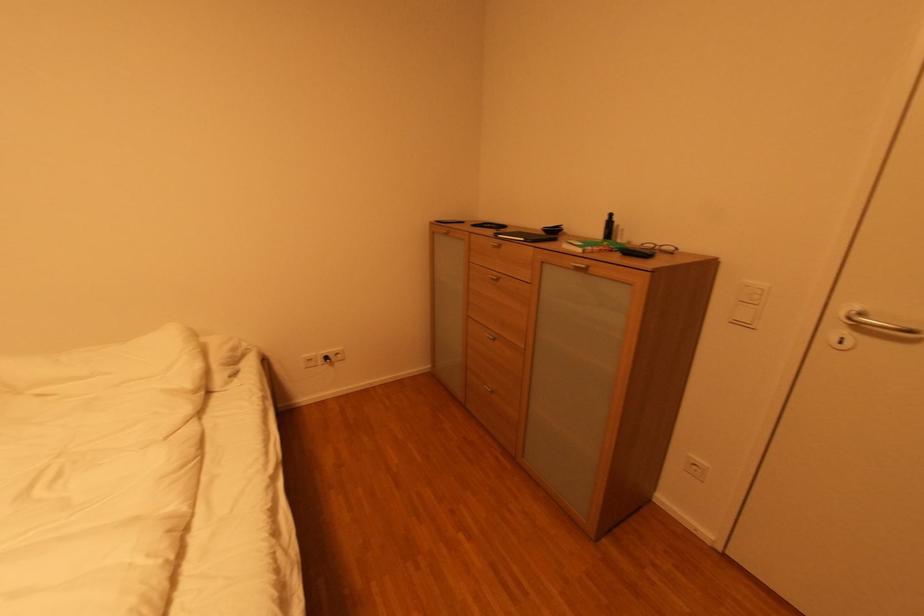
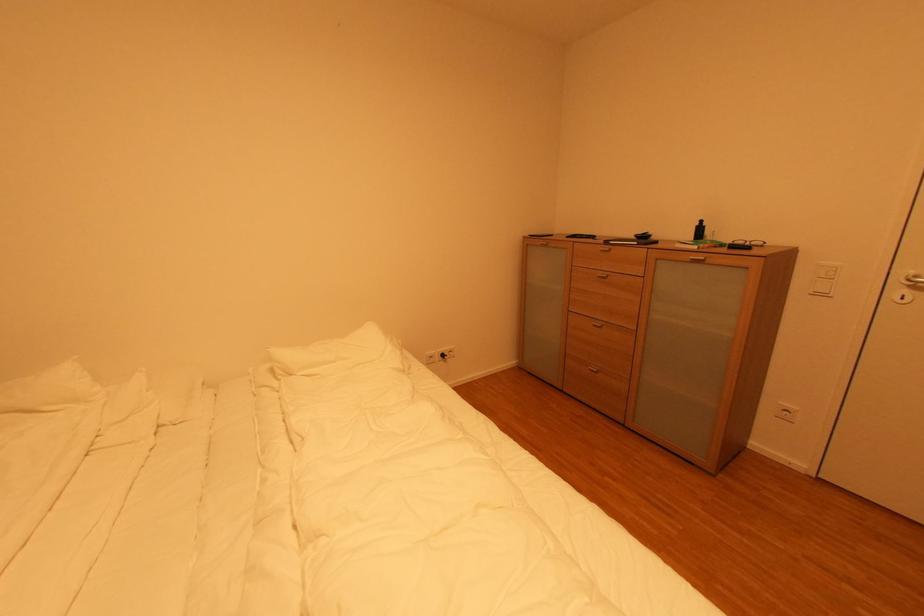
Question: The first image is from the beginning of the video and the second image is from the end. How did the camera likely rotate when shooting the video?

Choices:
 (A) Left
 (B) Right
 (C) Up
 (D) Down

Answer: (C)